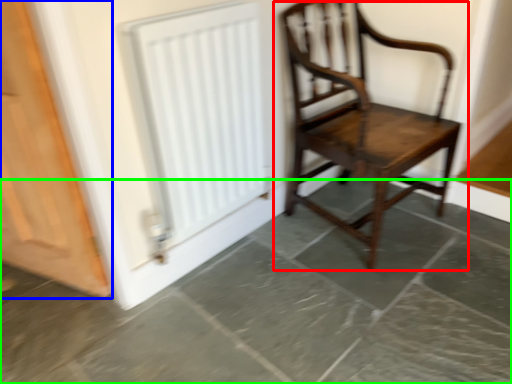
Question: Which is nearer to the chair (highlighted by a red box)? door (highlighted by a blue box) or concrete (highlighted by a green box).

Choices:
 (A) door
 (B) concrete

Answer: (B)